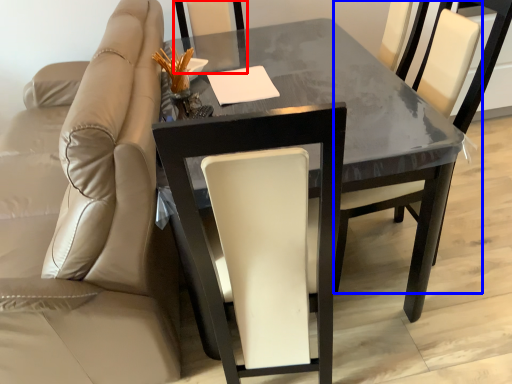
Question: Which object appears closest to the camera in this image, chair (highlighted by a red box) or chair (highlighted by a blue box)?

Choices:
 (A) chair
 (B) chair

Answer: (B)